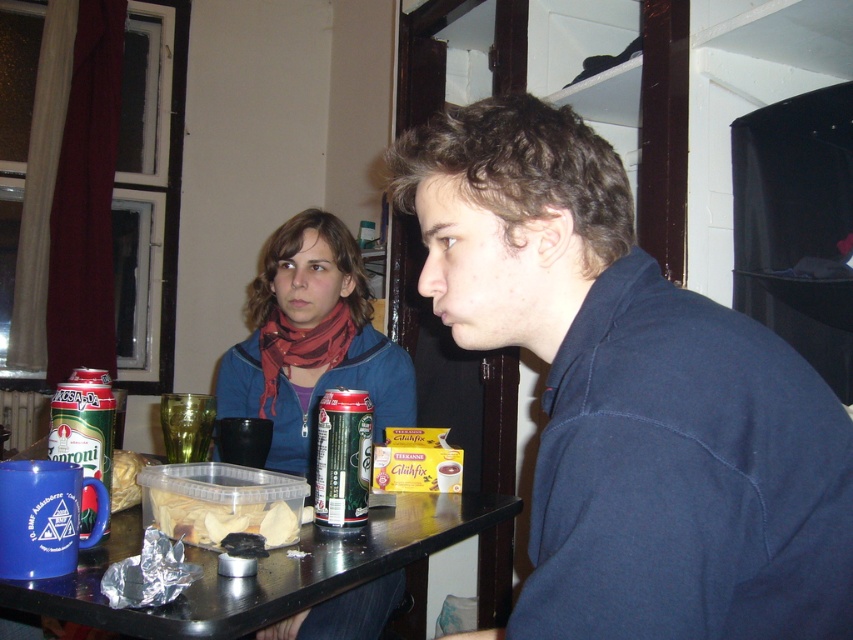
Does blue fabric scarf at upper left come in front of green metallic can at center?

No, blue fabric scarf at upper left is behind green metallic can at center.

The height and width of the screenshot is (640, 853). Describe the element at coordinates (310, 340) in the screenshot. I see `blue fabric scarf at upper left` at that location.

Where is `blue fabric scarf at upper left`? blue fabric scarf at upper left is located at coordinates [x=310, y=340].

Can you confirm if blue fabric scarf at upper left is taller than green metallic can at lower left?

Correct, blue fabric scarf at upper left is much taller as green metallic can at lower left.

Describe the element at coordinates (310, 340) in the screenshot. The width and height of the screenshot is (853, 640). I see `blue fabric scarf at upper left` at that location.

Which is in front, point (329, 368) or point (107, 404)?

Point (107, 404) is in front.

Locate an element on the screen. Image resolution: width=853 pixels, height=640 pixels. blue fabric scarf at upper left is located at coordinates (310, 340).

Is blue fleece jacket at center positioned before green metallic can at center?

Yes, blue fleece jacket at center is closer to the viewer.

Is blue fleece jacket at center thinner than green metallic can at center?

No, blue fleece jacket at center is not thinner than green metallic can at center.

The width and height of the screenshot is (853, 640). Describe the element at coordinates (631, 396) in the screenshot. I see `blue fleece jacket at center` at that location.

Identify the location of blue fleece jacket at center. (631, 396).